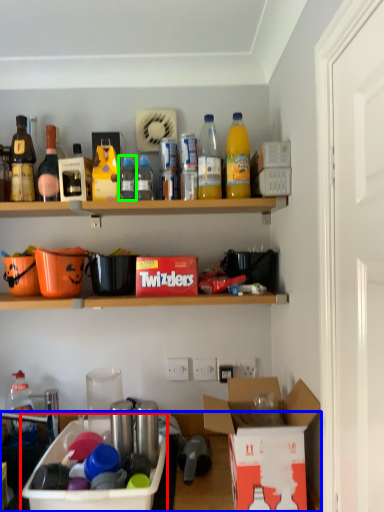
Question: Based on their relative distances, which object is nearer to box (highlighted by a red box)? Choose from desk (highlighted by a blue box) and bottle (highlighted by a green box).

Choices:
 (A) desk
 (B) bottle

Answer: (A)